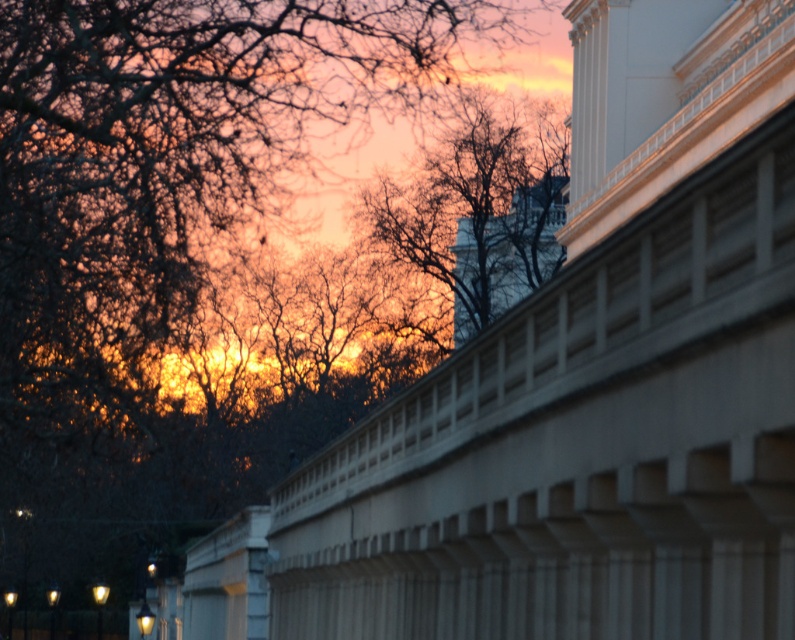
Is brown leafless tree at upper left in front of brown textured tree at center?

Yes.

Is point (128, 166) positioned behind point (477, 328)?

No, (128, 166) is in front of (477, 328).

Does point (41, 593) come closer to viewer compared to point (413, 204)?

No, (41, 593) is behind (413, 204).

Image resolution: width=795 pixels, height=640 pixels. In order to click on brown leafless tree at upper left in this screenshot , I will do `click(200, 260)`.